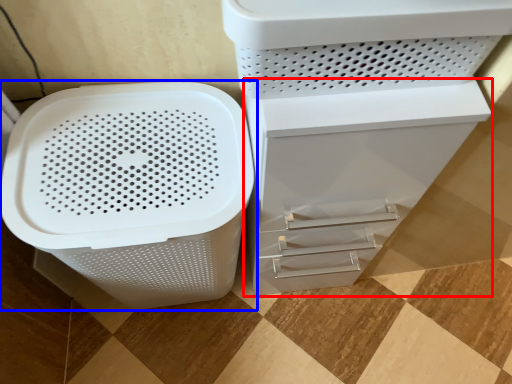
Question: Which of the following is the closest to the observer, file cabinet (highlighted by a red box) or waste container (highlighted by a blue box)?

Choices:
 (A) file cabinet
 (B) waste container

Answer: (A)